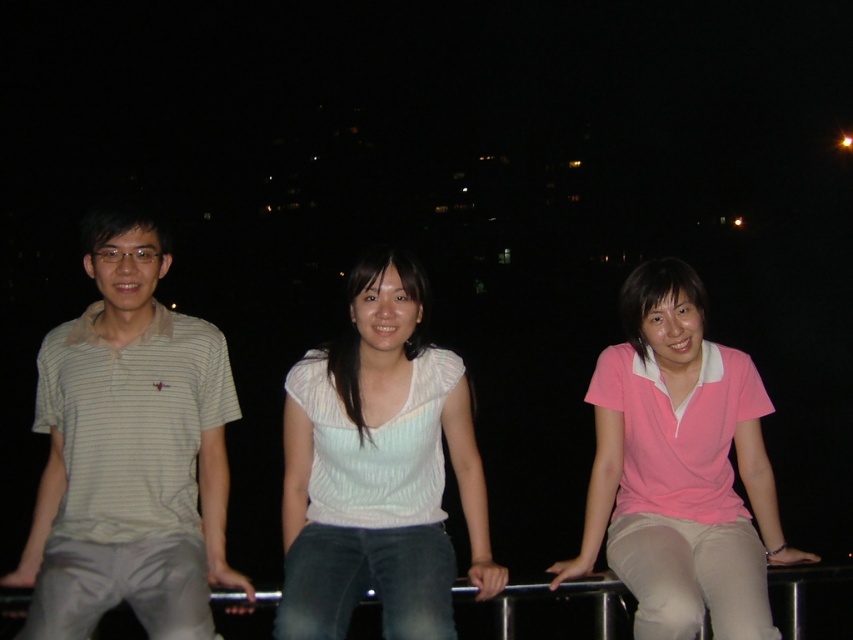
Question: Which object is the closest to the white striped shirt at left?

Choices:
 (A) pink matte shirt at center
 (B) white matte shirt at center

Answer: (B)

Question: Does white striped shirt at left have a lesser width compared to white matte shirt at center?

Choices:
 (A) yes
 (B) no

Answer: (B)

Question: Estimate the real-world distances between objects in this image. Which object is closer to the white striped shirt at left?

Choices:
 (A) pink matte shirt at center
 (B) white matte shirt at center

Answer: (B)

Question: Observing the image, what is the correct spatial positioning of white striped shirt at left in reference to pink matte shirt at center?

Choices:
 (A) below
 (B) above

Answer: (B)

Question: Which of the following is the farthest from the observer?

Choices:
 (A) (94, 401)
 (B) (367, 394)

Answer: (B)

Question: Considering the relative positions of white striped shirt at left and pink matte shirt at center in the image provided, where is white striped shirt at left located with respect to pink matte shirt at center?

Choices:
 (A) below
 (B) above

Answer: (B)